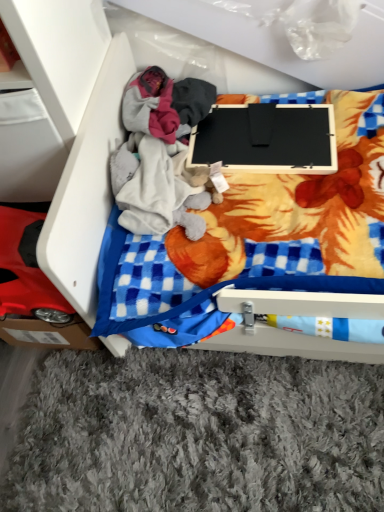
The height and width of the screenshot is (512, 384). Identify the location of black matte laptop at center. (266, 139).

Measure the distance between point (232, 117) and camera.

Point (232, 117) is 3.94 feet from camera.

The height and width of the screenshot is (512, 384). What do you see at coordinates (266, 139) in the screenshot?
I see `black matte laptop at center` at bounding box center [266, 139].

The width and height of the screenshot is (384, 512). In order to click on white plastic drawer at upper left in this screenshot , I will do (86, 188).

Image resolution: width=384 pixels, height=512 pixels. What do you see at coordinates (86, 188) in the screenshot? I see `white plastic drawer at upper left` at bounding box center [86, 188].

Identify the location of black matte laptop at center. (266, 139).

In the image, is white plastic drawer at upper left on the left side or the right side of black matte laptop at center?

Clearly, white plastic drawer at upper left is on the left of black matte laptop at center in the image.

Is the depth of white plastic drawer at upper left greater than that of black matte laptop at center?

No, white plastic drawer at upper left is closer to the viewer.

Is point (99, 73) positioned behind point (248, 142)?

No, it is not.

From the image's perspective, does white plastic drawer at upper left appear lower than black matte laptop at center?

Yes.

From a real-world perspective, is white plastic drawer at upper left physically below black matte laptop at center?

Correct, in the physical world, white plastic drawer at upper left is lower than black matte laptop at center.

Considering the sizes of white plastic drawer at upper left and black matte laptop at center in the image, is white plastic drawer at upper left wider or thinner than black matte laptop at center?

Considering their sizes, white plastic drawer at upper left looks broader than black matte laptop at center.

Is white plastic drawer at upper left taller than black matte laptop at center?

Yes, white plastic drawer at upper left is taller than black matte laptop at center.

Does white plastic drawer at upper left have a smaller size compared to black matte laptop at center?

Incorrect, white plastic drawer at upper left is not smaller in size than black matte laptop at center.

Can we say white plastic drawer at upper left lies outside black matte laptop at center?

That's correct, white plastic drawer at upper left is outside of black matte laptop at center.

Can you see white plastic drawer at upper left touching black matte laptop at center?

No, white plastic drawer at upper left is not with black matte laptop at center.

Is white plastic drawer at upper left aimed at black matte laptop at center?

Yes, white plastic drawer at upper left is facing black matte laptop at center.

Locate an element on the screen. This screenshot has width=384, height=512. laptop above the white plastic drawer at upper left (from a real-world perspective) is located at coordinates (266, 139).

Considering the positions of objects black matte laptop at center and white plastic drawer at upper left in the image provided, who is more to the right, black matte laptop at center or white plastic drawer at upper left?

Positioned to the right is black matte laptop at center.

From the picture: Which object is closer to the camera, black matte laptop at center or white plastic drawer at upper left?

white plastic drawer at upper left is in front.

Does point (220, 109) appear closer or farther from the camera than point (101, 95)?

Point (220, 109) appears to be farther away from the viewer than point (101, 95).

From the image's perspective, relative to white plastic drawer at upper left, is black matte laptop at center above or below?

Based on their image positions, black matte laptop at center is located above white plastic drawer at upper left.

From a real-world perspective, does black matte laptop at center sit lower than white plastic drawer at upper left?

No, from a real-world perspective, black matte laptop at center is not beneath white plastic drawer at upper left.

Which of these two, black matte laptop at center or white plastic drawer at upper left, is thinner?

With smaller width is black matte laptop at center.

Considering the sizes of objects black matte laptop at center and white plastic drawer at upper left in the image provided, who is shorter, black matte laptop at center or white plastic drawer at upper left?

Standing shorter between the two is black matte laptop at center.

In terms of size, does black matte laptop at center appear bigger or smaller than white plastic drawer at upper left?

In the image, black matte laptop at center appears to be smaller than white plastic drawer at upper left.

Is black matte laptop at center positioned beyond the bounds of white plastic drawer at upper left?

Actually, black matte laptop at center is within white plastic drawer at upper left.

Is black matte laptop at center far away from white plastic drawer at upper left?

No, black matte laptop at center is not far away from white plastic drawer at upper left.

Is black matte laptop at center positioned with its back to white plastic drawer at upper left?

Yes, black matte laptop at center's orientation is away from white plastic drawer at upper left.

You are a GUI agent. You are given a task and a screenshot of the screen. Output one action in this format:
    pyautogui.click(x=<x>, y=<y>)
    Task: Click on the laptop above the white plastic drawer at upper left (from the image's perspective)
    This screenshot has width=384, height=512.
    Given the screenshot: What is the action you would take?
    pyautogui.click(x=266, y=139)

Where is `furniture on the left of the black matte laptop at center`? furniture on the left of the black matte laptop at center is located at coordinates (86, 188).

At what (x,y) coordinates should I click in order to perform the action: click on furniture in front of the black matte laptop at center. Please return your answer as a coordinate pair (x, y). The image size is (384, 512). Looking at the image, I should click on (86, 188).